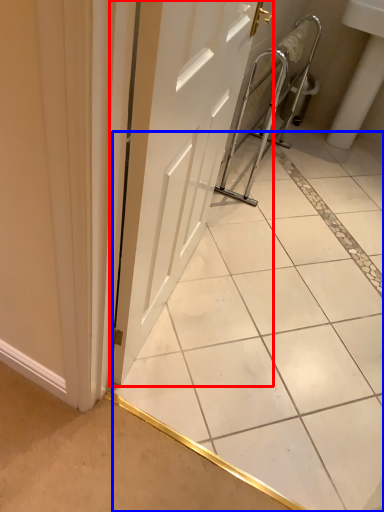
Question: Which object is closer to the camera taking this photo, door (highlighted by a red box) or ceramic tile (highlighted by a blue box)?

Choices:
 (A) door
 (B) ceramic tile

Answer: (B)